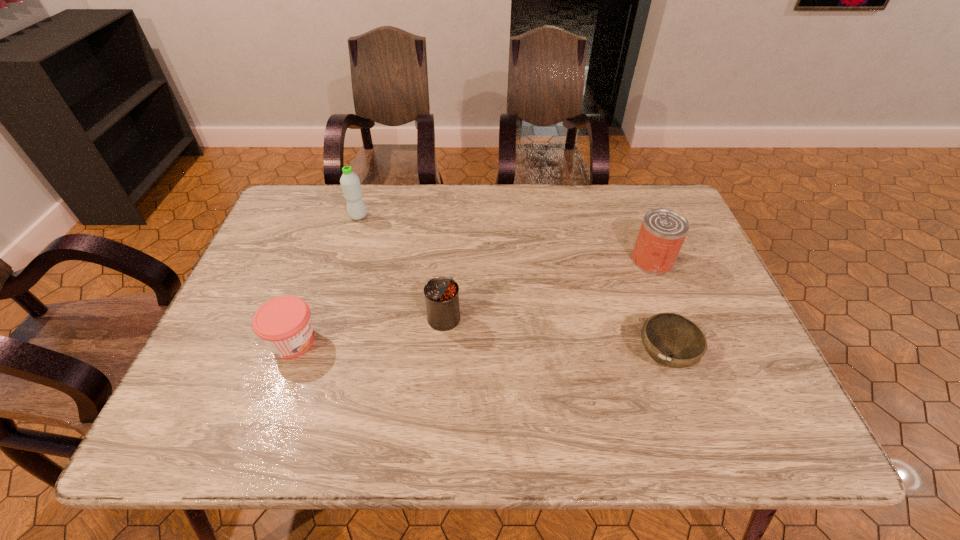
Identify the location of vacant space situated 0.390m on the back of the third object from left to right. Image resolution: width=960 pixels, height=540 pixels. (452, 208).

Image resolution: width=960 pixels, height=540 pixels. I want to click on vacant space situated 0.200m on the front label of the fourth tallest object, so click(x=407, y=341).

Where is `vacant point located 0.140m on the left of the shortest object`? This screenshot has height=540, width=960. vacant point located 0.140m on the left of the shortest object is located at coordinates (571, 357).

The height and width of the screenshot is (540, 960). Identify the location of object positioned at the far edge. (349, 181).

Where is `object that is at the left edge`? object that is at the left edge is located at coordinates (284, 324).

You are a GUI agent. You are given a task and a screenshot of the screen. Output one action in this format:
    pyautogui.click(x=<x>, y=<y>)
    Task: Click on the can present at the right edge
    This screenshot has width=960, height=540.
    Given the screenshot: What is the action you would take?
    pyautogui.click(x=663, y=231)

The image size is (960, 540). Identify the location of bowl located at the right edge. (672, 340).

In order to click on vacant space at the far edge in this screenshot , I will do `click(425, 227)`.

Identify the location of vacant space at the near edge of the desktop. (299, 411).

Locate an element on the screen. The image size is (960, 540). vacant space at the left edge is located at coordinates (252, 298).